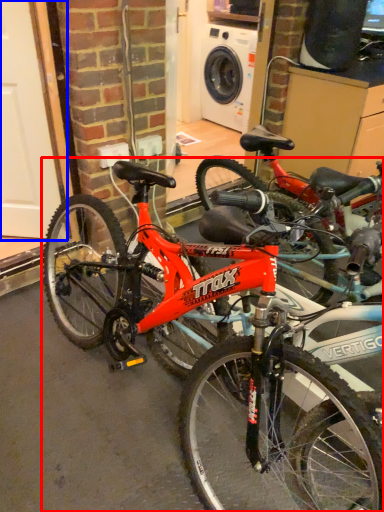
Question: Among these objects, which one is farthest to the camera, bicycle (highlighted by a red box) or garage door (highlighted by a blue box)?

Choices:
 (A) bicycle
 (B) garage door

Answer: (B)